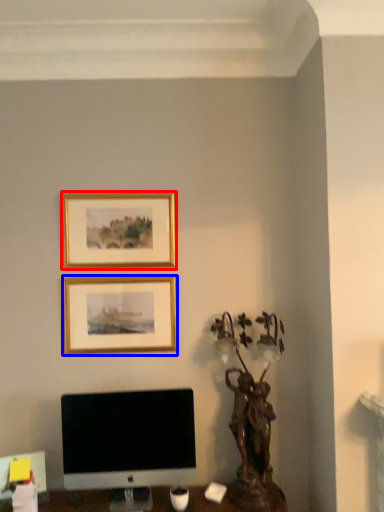
Question: Which point is further to the camera, picture frame (highlighted by a red box) or picture frame (highlighted by a blue box)?

Choices:
 (A) picture frame
 (B) picture frame

Answer: (A)